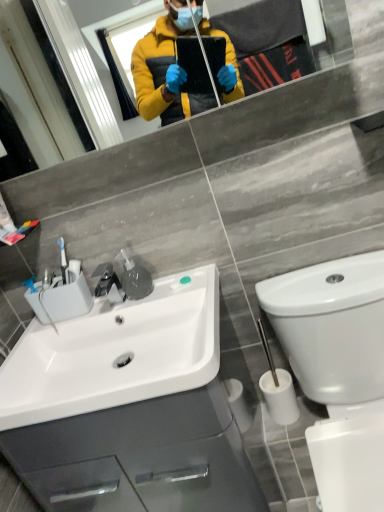
The height and width of the screenshot is (512, 384). In order to click on white glossy sink at lower left in this screenshot , I will do `click(116, 353)`.

What are the coordinates of `white glossy toilet at lower right` in the screenshot? It's located at (333, 330).

This screenshot has height=512, width=384. In order to click on white glossy cabinet at lower left in this screenshot , I will do coord(140,458).

In order to click on white glossy sink at lower left in this screenshot , I will do `click(116, 353)`.

Between matte glass mirror at upper center and white glossy cabinet at lower left, which one appears on the left side from the viewer's perspective?

From the viewer's perspective, matte glass mirror at upper center appears more on the left side.

Who is shorter, matte glass mirror at upper center or white glossy cabinet at lower left?

Standing shorter between the two is matte glass mirror at upper center.

You are a GUI agent. You are given a task and a screenshot of the screen. Output one action in this format:
    pyautogui.click(x=<x>, y=<y>)
    Task: Click on the bathroom cabinet on the right of the matte glass mirror at upper center
    The height and width of the screenshot is (512, 384).
    Given the screenshot: What is the action you would take?
    [x=140, y=458]

From the image's perspective, would you say white glossy sink at lower left is positioned over white glossy cabinet at lower left?

Indeed, from the image's perspective, white glossy sink at lower left is shown above white glossy cabinet at lower left.

Is white glossy sink at lower left further to camera compared to white glossy cabinet at lower left?

No.

Locate an element on the screen. sink on the left side of white glossy cabinet at lower left is located at coordinates (116, 353).

Is white glossy sink at lower left looking in the opposite direction of white glossy cabinet at lower left?

white glossy sink at lower left is not turned away from white glossy cabinet at lower left.

Can white glossy toilet at lower right be found inside white glossy sink at lower left?

No, white glossy toilet at lower right is not inside white glossy sink at lower left.

Could you tell me if white glossy sink at lower left is facing white glossy toilet at lower right?

No, white glossy sink at lower left is not oriented towards white glossy toilet at lower right.

Can you see white glossy sink at lower left touching white glossy toilet at lower right?

white glossy sink at lower left and white glossy toilet at lower right are clearly separated.

Are matte glass mirror at upper center and white glossy toilet at lower right far apart?

Yes, matte glass mirror at upper center is far from white glossy toilet at lower right.

Can we say matte glass mirror at upper center lies outside white glossy toilet at lower right?

Yes, matte glass mirror at upper center is outside of white glossy toilet at lower right.

Is matte glass mirror at upper center taller or shorter than white glossy toilet at lower right?

Considering their sizes, matte glass mirror at upper center has less height than white glossy toilet at lower right.

Looking at this image, from a real-world perspective, is white glossy sink at lower left on top of matte glass mirror at upper center?

Actually, white glossy sink at lower left is physically below matte glass mirror at upper center in the real world.

Is white glossy sink at lower left smaller than matte glass mirror at upper center?

No, white glossy sink at lower left is not smaller than matte glass mirror at upper center.

Measure the distance from white glossy cabinet at lower left to white glossy sink at lower left.

white glossy cabinet at lower left is 7.75 inches from white glossy sink at lower left.

In terms of height, does white glossy cabinet at lower left look taller or shorter compared to white glossy sink at lower left?

white glossy cabinet at lower left is taller than white glossy sink at lower left.

From the image's perspective, is white glossy cabinet at lower left located beneath white glossy sink at lower left?

Yes, from the image's perspective, white glossy cabinet at lower left is beneath white glossy sink at lower left.

Looking at their sizes, would you say white glossy toilet at lower right is wider or thinner than white glossy cabinet at lower left?

Considering their sizes, white glossy toilet at lower right looks broader than white glossy cabinet at lower left.

From the picture: Is white glossy toilet at lower right facing towards white glossy cabinet at lower left?

No.

How much distance is there between white glossy toilet at lower right and white glossy cabinet at lower left?

white glossy toilet at lower right and white glossy cabinet at lower left are 46.66 centimeters apart.

Considering the relative sizes of white glossy toilet at lower right and white glossy cabinet at lower left in the image provided, is white glossy toilet at lower right bigger than white glossy cabinet at lower left?

Actually, white glossy toilet at lower right might be smaller than white glossy cabinet at lower left.

This screenshot has width=384, height=512. There is a white glossy cabinet at lower left. What are the coordinates of `mirror above it (from a real-world perspective)` in the screenshot? It's located at (351, 30).

Identify the location of bathroom cabinet located underneath the white glossy sink at lower left (from a real-world perspective). The height and width of the screenshot is (512, 384). (140, 458).

Considering their positions, is white glossy toilet at lower right positioned closer to matte glass mirror at upper center than white glossy sink at lower left?

Among the two, white glossy sink at lower left is located nearer to matte glass mirror at upper center.

When comparing their distances from white glossy cabinet at lower left, does matte glass mirror at upper center or white glossy sink at lower left seem closer?

Based on the image, white glossy sink at lower left appears to be nearer to white glossy cabinet at lower left.

Considering their positions, is matte glass mirror at upper center positioned closer to white glossy toilet at lower right than white glossy sink at lower left?

white glossy sink at lower left is closer to white glossy toilet at lower right.

Looking at the image, which one is located closer to white glossy toilet at lower right, white glossy cabinet at lower left or matte glass mirror at upper center?

white glossy cabinet at lower left lies closer to white glossy toilet at lower right than the other object.

Which object lies further to the anchor point white glossy cabinet at lower left, matte glass mirror at upper center or white glossy toilet at lower right?

matte glass mirror at upper center is positioned further to the anchor white glossy cabinet at lower left.

Which object lies further to the anchor point white glossy sink at lower left, white glossy toilet at lower right or white glossy cabinet at lower left?

Based on the image, white glossy toilet at lower right appears to be further to white glossy sink at lower left.

Estimate the real-world distances between objects in this image. Which object is further from white glossy sink at lower left, matte glass mirror at upper center or white glossy toilet at lower right?

Among the two, matte glass mirror at upper center is located further to white glossy sink at lower left.

From the image, which object appears to be nearer to matte glass mirror at upper center, white glossy sink at lower left or white glossy toilet at lower right?

Among the two, white glossy sink at lower left is located nearer to matte glass mirror at upper center.

At what (x,y) coordinates should I click in order to perform the action: click on bathroom cabinet located between white glossy sink at lower left and white glossy toilet at lower right in the left-right direction. Please return your answer as a coordinate pair (x, y). Looking at the image, I should click on (140, 458).

This screenshot has height=512, width=384. I want to click on toilet between matte glass mirror at upper center and white glossy cabinet at lower left from top to bottom, so click(333, 330).

I want to click on sink between matte glass mirror at upper center and white glossy cabinet at lower left in the vertical direction, so click(x=116, y=353).

Find the location of a particular element. This screenshot has width=384, height=512. sink that lies between matte glass mirror at upper center and white glossy toilet at lower right from top to bottom is located at coordinates pos(116,353).